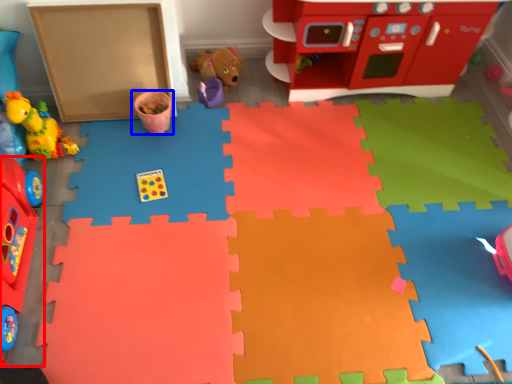
Question: Which point is further to the camera, toy (highlighted by a red box) or toy (highlighted by a blue box)?

Choices:
 (A) toy
 (B) toy

Answer: (B)